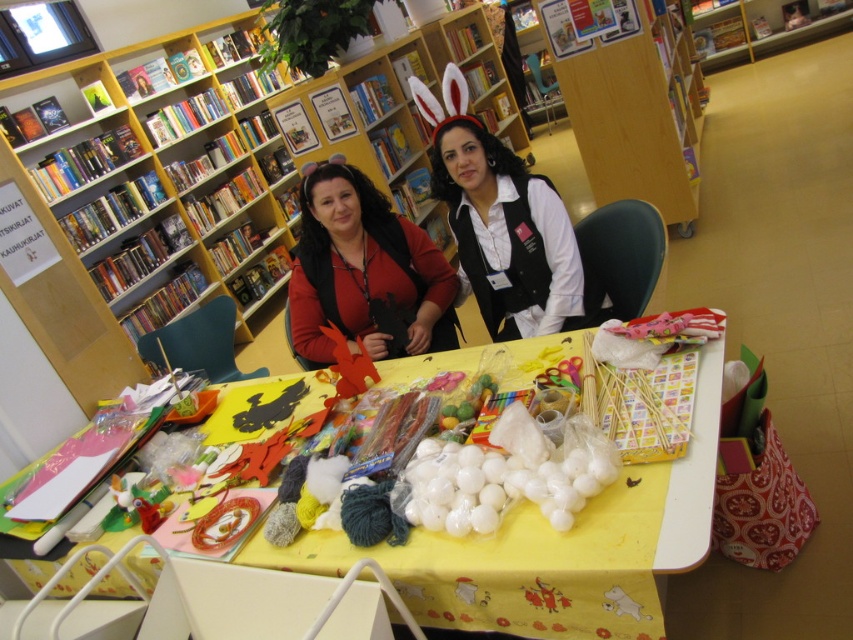
Question: Which point is closer to the camera?

Choices:
 (A) (495, 193)
 (B) (442, 602)

Answer: (B)

Question: Is black matte vest at center smaller than matte red sweater at center?

Choices:
 (A) yes
 (B) no

Answer: (B)

Question: Among these objects, which one is farthest from the camera?

Choices:
 (A) yellow paper table at center
 (B) black matte vest at center

Answer: (B)

Question: Does yellow paper table at center have a smaller size compared to black matte vest at center?

Choices:
 (A) no
 (B) yes

Answer: (B)

Question: Estimate the real-world distances between objects in this image. Which object is closer to the yellow paper table at center?

Choices:
 (A) matte red sweater at center
 (B) black matte vest at center

Answer: (B)

Question: Does black matte vest at center have a smaller size compared to matte red sweater at center?

Choices:
 (A) yes
 (B) no

Answer: (B)